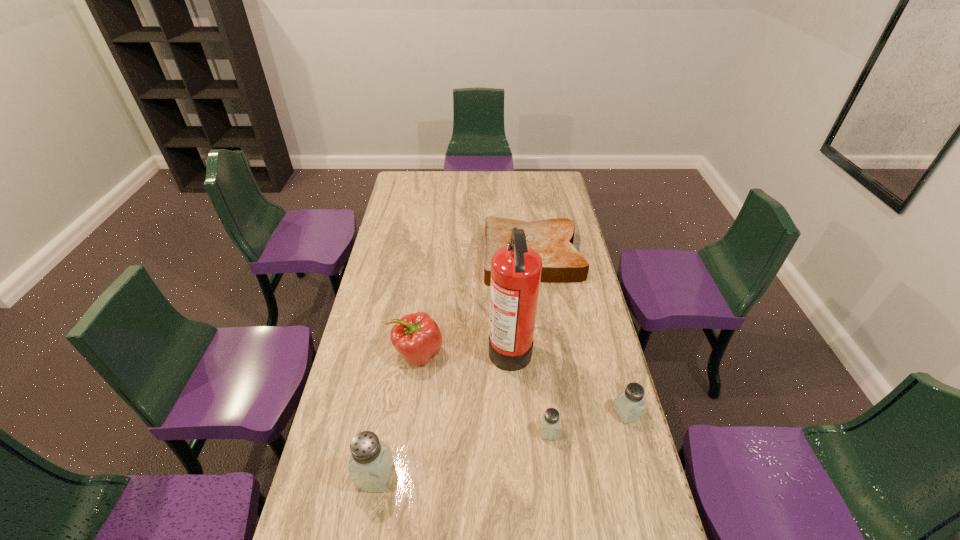
Identify the location of the nearest object. (371, 461).

In order to click on the tallest saltshaker in this screenshot , I will do pyautogui.click(x=371, y=461).

Find the location of `the shortest saltshaker`. the shortest saltshaker is located at coordinates (550, 422).

Image resolution: width=960 pixels, height=540 pixels. What are the coordinates of `the second shortest object` in the screenshot? It's located at (550, 422).

At what (x,y) coordinates should I click in order to perform the action: click on the rightmost saltshaker. Please return your answer as a coordinate pair (x, y). Looking at the image, I should click on (629, 404).

The image size is (960, 540). Identify the location of the third shortest object. (629, 404).

The image size is (960, 540). In order to click on fire extinguisher in this screenshot , I will do coord(516,269).

Where is `pepper`? pepper is located at coordinates (417, 337).

Find the location of a particular element. The image size is (960, 540). bread is located at coordinates (562, 263).

Image resolution: width=960 pixels, height=540 pixels. Identify the location of the farthest object. (562, 263).